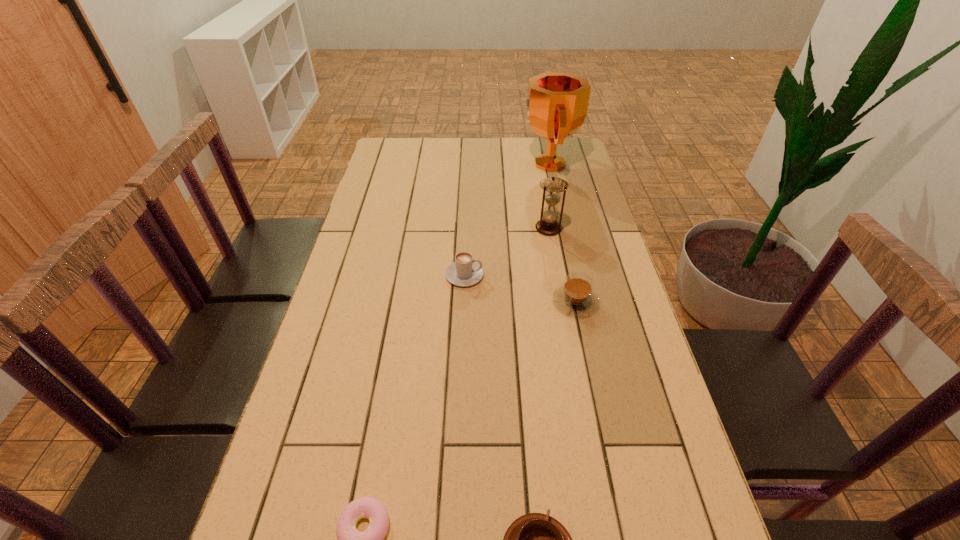
Find the location of a particular element. The image size is (960, 540). blank area at the far left corner is located at coordinates (415, 164).

This screenshot has width=960, height=540. I want to click on free point at the far right corner, so click(x=559, y=148).

Locate an element on the screen. empty space between the farthest object and the rightmost cappuccino is located at coordinates (562, 233).

This screenshot has height=540, width=960. What are the coordinates of `free area in between the rightmost cappuccino and the fifth nearest object` in the screenshot? It's located at (562, 265).

Where is `free space between the fifth object from right to left and the fifth nearest object`? This screenshot has height=540, width=960. free space between the fifth object from right to left and the fifth nearest object is located at coordinates (507, 252).

Where is `free point between the tallest object and the rightmost cappuccino`? The width and height of the screenshot is (960, 540). free point between the tallest object and the rightmost cappuccino is located at coordinates (562, 233).

Identify the location of free space between the second farthest object and the rightmost cappuccino. The width and height of the screenshot is (960, 540). (562, 265).

Locate an element on the screen. This screenshot has height=540, width=960. object that is the fifth closest one to the fifth shortest object is located at coordinates (349, 539).

Choose which object is the third nearest neighbor to the rightmost cappuccino. Please provide its 2D coordinates. Your answer should be formatted as a tuple, i.e. [(x, y)], where the tuple contains the x and y coordinates of a point satisfying the conditions above.

[(535, 539)]

I want to click on cappuccino that is the second closest to the second object from left to right, so click(535, 539).